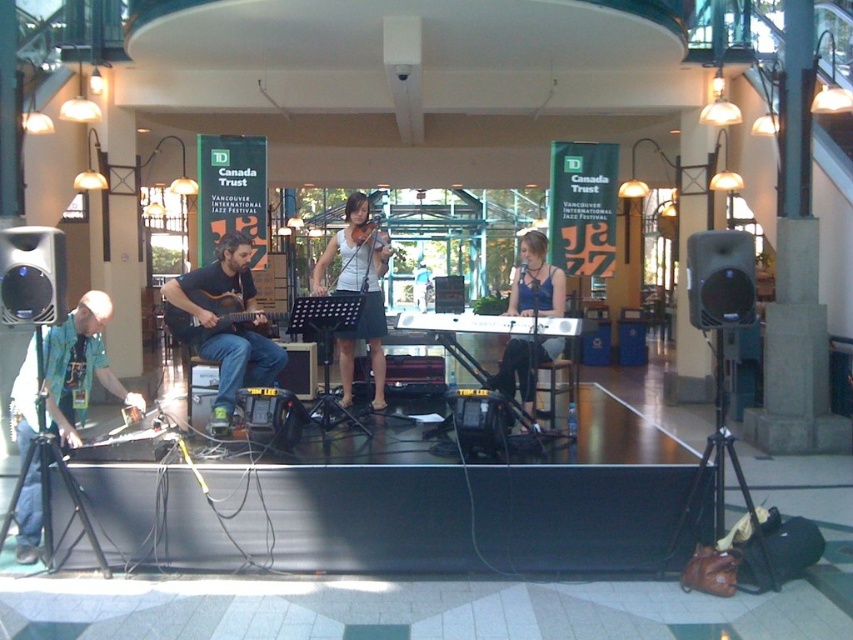
You are a photographer positioned at the back of the stage. You want to capture a photo that includes both the white fabric skirt at center and the acoustic wood guitar at center. What is the minimum distance you need to maintain between the camera and the stage to ensure both objects are in frame?

The minimum distance you need to maintain between the camera and the stage should be at least 3.51 feet to ensure both the white fabric skirt at center and the acoustic wood guitar at center are in frame, as they are positioned 3.51 feet apart.

Consider the image. You are a photographer positioned at the center of the stage. You want to take a closeup shot of the matte black guitar at left. Which direction should you move to get closer to it?

The matte black guitar at left is located at point (223, 323), so you should move to the left to get closer to it.